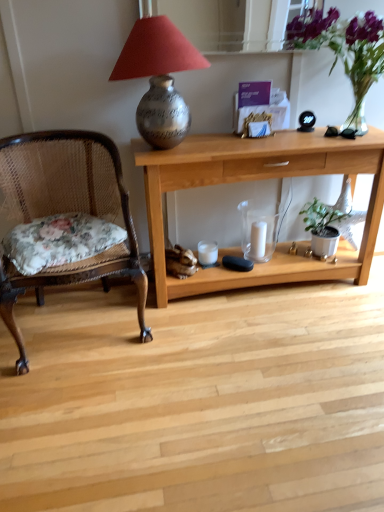
Identify the location of vacant area to the right of silver textured vase at upper center. The height and width of the screenshot is (512, 384). (240, 142).